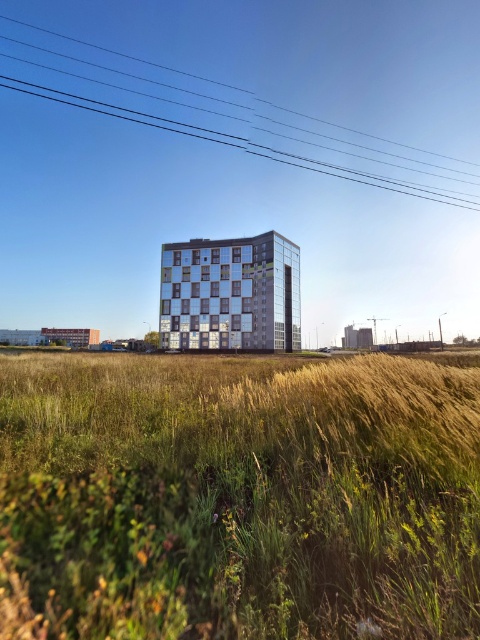
Question: Is green grass at center to the right of clear wire at upper center from the viewer's perspective?

Choices:
 (A) no
 (B) yes

Answer: (B)

Question: Which object appears farthest from the camera in this image?

Choices:
 (A) green grass at center
 (B) clear wire at upper center

Answer: (B)

Question: Is green grass at center bigger than clear wire at upper center?

Choices:
 (A) no
 (B) yes

Answer: (A)

Question: Which point appears farthest from the camera in this image?

Choices:
 (A) 184,356
 (B) 175,67

Answer: (B)

Question: Does green grass at center have a larger size compared to clear wire at upper center?

Choices:
 (A) yes
 (B) no

Answer: (B)

Question: Among these objects, which one is farthest from the camera?

Choices:
 (A) clear wire at upper center
 (B) green grass at center

Answer: (A)